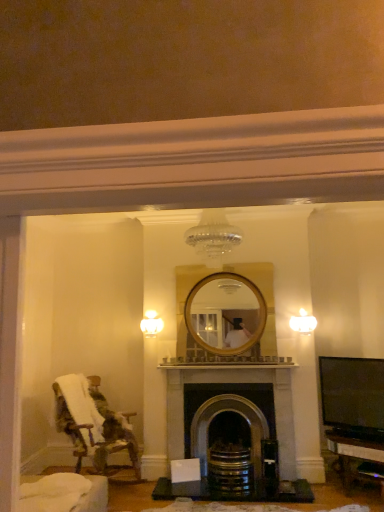
Question: Is dark gray stone fireplace at center with white frosted glass sconce at upper right, placed as the second light fixture when sorted from left to right?

Choices:
 (A) yes
 (B) no

Answer: (B)

Question: From a real-world perspective, is dark gray stone fireplace at center physically above white frosted glass sconce at upper right, which is counted as the second light fixture, starting from the back?

Choices:
 (A) yes
 (B) no

Answer: (B)

Question: From the image's perspective, is dark gray stone fireplace at center beneath white frosted glass sconce at upper right, which is counted as the first light fixture, starting from the right?

Choices:
 (A) no
 (B) yes

Answer: (B)

Question: Considering the relative sizes of dark gray stone fireplace at center and white frosted glass sconce at upper right, placed as the second light fixture when sorted from left to right, in the image provided, is dark gray stone fireplace at center bigger than white frosted glass sconce at upper right, placed as the second light fixture when sorted from left to right,?

Choices:
 (A) yes
 (B) no

Answer: (A)

Question: Is dark gray stone fireplace at center facing away from white frosted glass sconce at upper right, which is counted as the second light fixture, starting from the back?

Choices:
 (A) yes
 (B) no

Answer: (B)

Question: From a real-world perspective, relative to fluffy fabric chair at left, is white glass light fixture at upper center, marked as the 1th light fixture in a left-to-right arrangement, vertically above or below?

Choices:
 (A) below
 (B) above

Answer: (B)

Question: In the image, is white glass light fixture at upper center, the second light fixture when ordered from front to back, positioned in front of or behind fluffy fabric chair at left?

Choices:
 (A) front
 (B) behind

Answer: (B)

Question: Considering the positions of point (147, 331) and point (127, 449), is point (147, 331) closer or farther from the camera than point (127, 449)?

Choices:
 (A) farther
 (B) closer

Answer: (A)

Question: In the image, is white glass light fixture at upper center, marked as the 1th light fixture in a left-to-right arrangement, on the left side or the right side of fluffy fabric chair at left?

Choices:
 (A) right
 (B) left

Answer: (A)

Question: Which is correct: dark gray stone fireplace at center is inside white frosted glass sconce at upper right, the first light fixture positioned from the front, or outside of it?

Choices:
 (A) outside
 (B) inside

Answer: (A)

Question: In the image, is dark gray stone fireplace at center positioned in front of or behind white frosted glass sconce at upper right, which is counted as the second light fixture, starting from the back?

Choices:
 (A) behind
 (B) front

Answer: (B)

Question: Considering the positions of point (168, 394) and point (301, 318), is point (168, 394) closer or farther from the camera than point (301, 318)?

Choices:
 (A) farther
 (B) closer

Answer: (B)

Question: From the image's perspective, is dark gray stone fireplace at center above or below white frosted glass sconce at upper right, which is counted as the first light fixture, starting from the right?

Choices:
 (A) above
 (B) below

Answer: (B)

Question: Is dark gray stone fireplace at center to the left or to the right of fluffy fabric chair at left in the image?

Choices:
 (A) right
 (B) left

Answer: (A)

Question: Considering the positions of point (180, 401) and point (54, 388), is point (180, 401) closer or farther from the camera than point (54, 388)?

Choices:
 (A) closer
 (B) farther

Answer: (B)